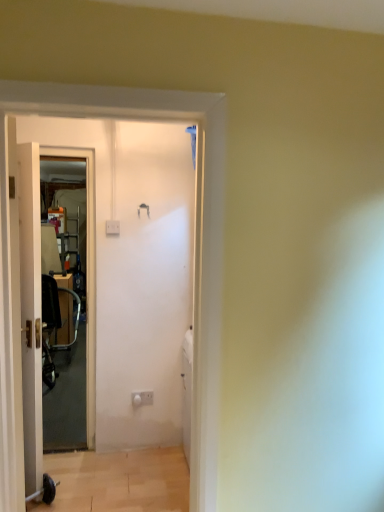
Question: Does point (135, 398) appear closer or farther from the camera than point (87, 358)?

Choices:
 (A) farther
 (B) closer

Answer: (B)

Question: Based on their positions, is white plastic electric outlet at center located to the left or right of wooden frame screen door at left?

Choices:
 (A) left
 (B) right

Answer: (B)

Question: Which object is the closest to the white plastic electric outlet at center?

Choices:
 (A) metallic silver baby carriage at left
 (B) wooden frame screen door at left
 (C) white wooden door at left

Answer: (B)

Question: Based on their relative distances, which object is nearer to the wooden frame screen door at left?

Choices:
 (A) white wooden door at left
 (B) metallic silver baby carriage at left
 (C) white plastic electric outlet at center

Answer: (C)